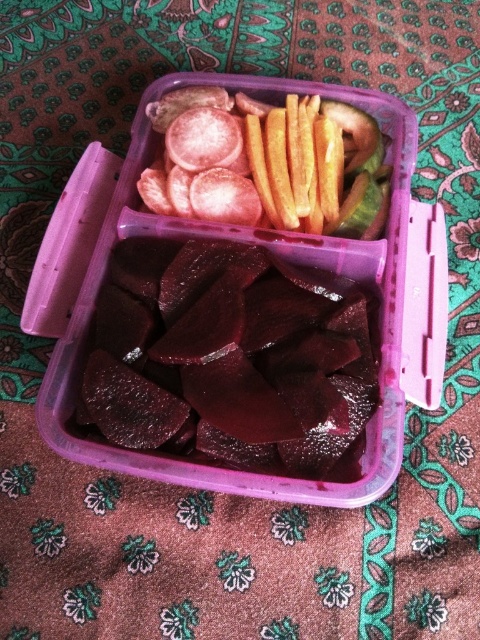
Question: Observing the image, what is the correct spatial positioning of dark red glossy beets at center in reference to smooth yellow french fries at center?

Choices:
 (A) left
 (B) right

Answer: (A)

Question: Which of the following is the farthest from the observer?

Choices:
 (A) smooth yellow french fries at center
 (B) dark red glossy beets at center

Answer: (A)

Question: Which of the following is the farthest from the observer?

Choices:
 (A) (119, 252)
 (B) (253, 196)

Answer: (B)

Question: Does dark red glossy beets at center appear over smooth yellow french fries at center?

Choices:
 (A) no
 (B) yes

Answer: (A)

Question: Can you confirm if dark red glossy beets at center is positioned above smooth yellow french fries at center?

Choices:
 (A) yes
 (B) no

Answer: (B)